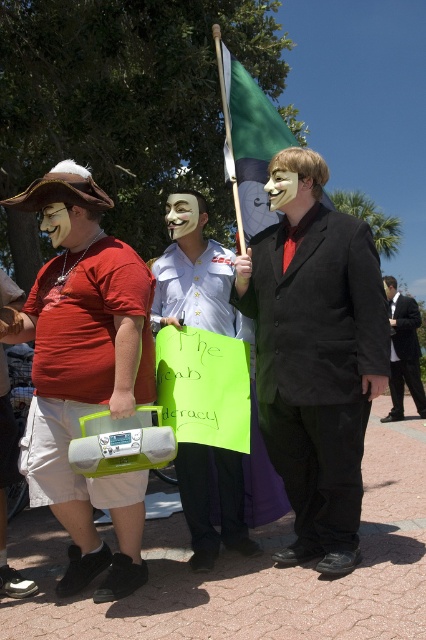
Question: Among these points, which one is farthest from the camera?

Choices:
 (A) (184, 193)
 (B) (66, 236)

Answer: (A)

Question: Which object is the closest to the green fabric flag at center?

Choices:
 (A) black suit at center
 (B) white matte mask at center

Answer: (B)

Question: Can you confirm if matte black suit at center is wider than matte white mask at center?

Choices:
 (A) yes
 (B) no

Answer: (A)

Question: Can you confirm if matte black laptop at left is positioned above black suit at center?

Choices:
 (A) no
 (B) yes

Answer: (B)

Question: Considering the real-world distances, which object is farthest from the matte white mask at center?

Choices:
 (A) white matte mask at center
 (B) matte black laptop at left

Answer: (B)

Question: Is black suit at center below matte white mask at center?

Choices:
 (A) no
 (B) yes

Answer: (B)